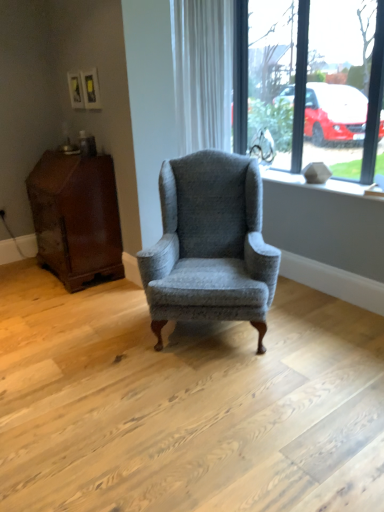
Where is `vacant area situated to the left side of textured gray wingback chair at center`? This screenshot has height=512, width=384. vacant area situated to the left side of textured gray wingback chair at center is located at coordinates (94, 334).